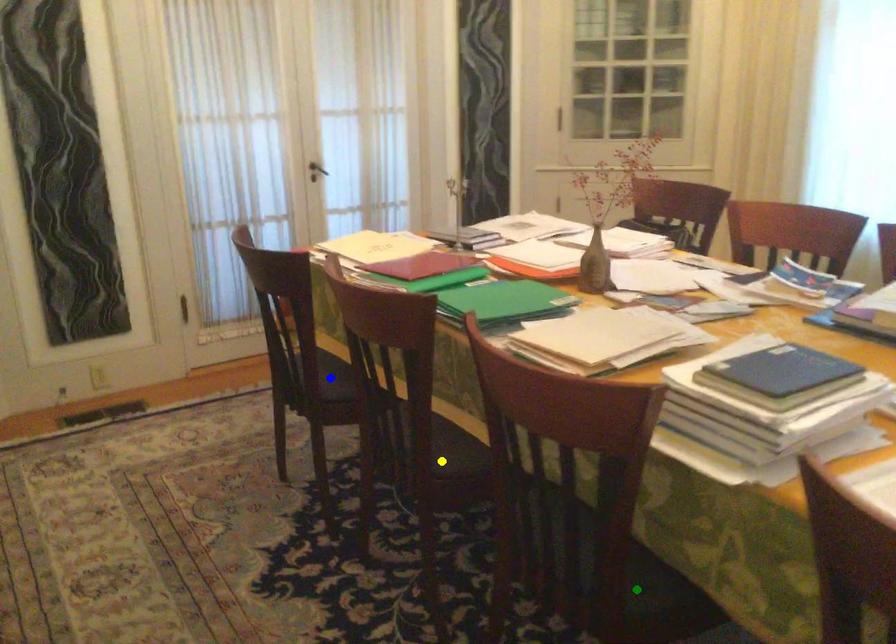
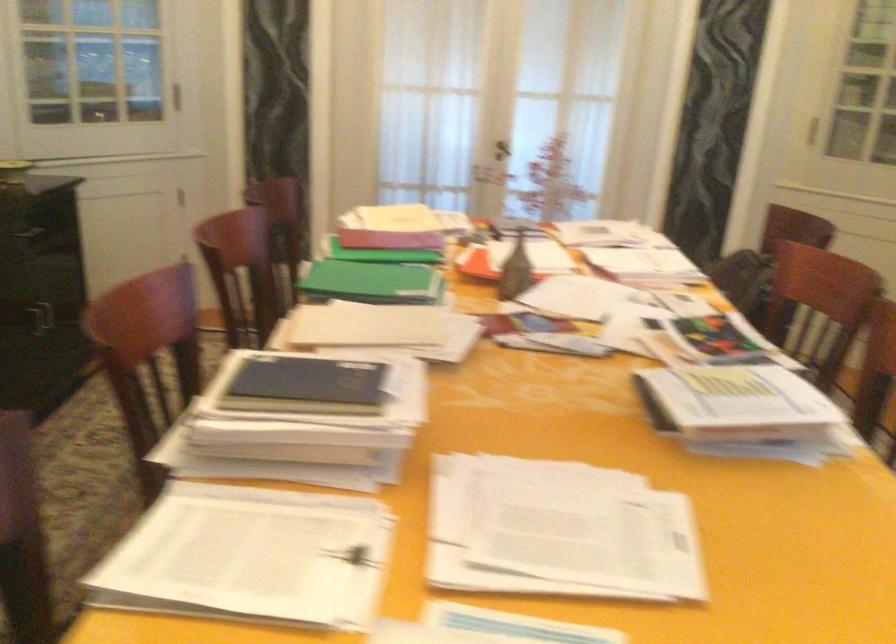
I am providing you with two images of the same scene from different viewpoints. Three points are marked in image1. Which point corresponds to a part or object that is occluded in image2?In image1, three points are marked. Which of them correspond to a part or object that is occluded in image2?Among the three points shown in image1, which one corresponds to a part or object that is no longer visible due to occlusion in image2?

blue point, yellow point, green point cannot be seen in image2.